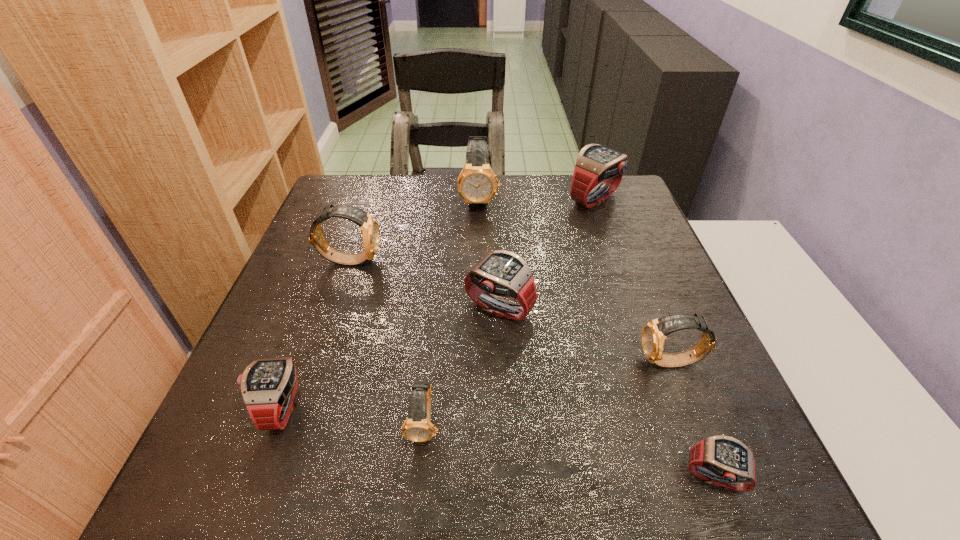
The image size is (960, 540). I want to click on free location that satisfies the following two spatial constraints: 1. on the back side of the nearest object; 2. on the face of the second farthest gold watch, so click(x=630, y=260).

At what (x,y) coordinates should I click in order to perform the action: click on free space that satisfies the following two spatial constraints: 1. on the face of the third object from left to right; 2. on the right side of the shortest object. Please return your answer as a coordinate pair (x, y). The height and width of the screenshot is (540, 960). Looking at the image, I should click on (419, 478).

Find the location of `vacant area that satisfies the following two spatial constraints: 1. on the face of the third gold watch from left to right; 2. on the left side of the shortest watch`. vacant area that satisfies the following two spatial constraints: 1. on the face of the third gold watch from left to right; 2. on the left side of the shortest watch is located at coordinates (478, 478).

You are a GUI agent. You are given a task and a screenshot of the screen. Output one action in this format:
    pyautogui.click(x=<x>, y=<y>)
    Task: Click on the vacant area that satisfies the following two spatial constraints: 1. on the face of the second farthest gold watch; 2. on the back side of the nearest watch
    
    Given the screenshot: What is the action you would take?
    pyautogui.click(x=276, y=478)